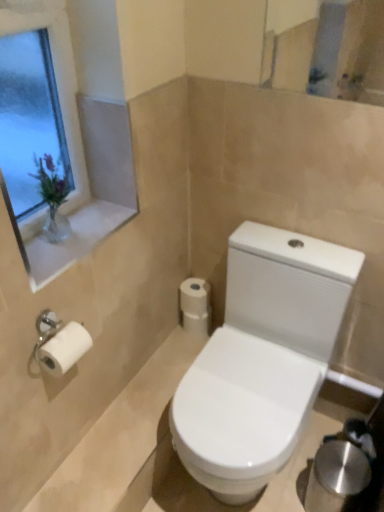
Question: Would you say white glossy toilet at lower center is part of clear glass vase at upper left's contents?

Choices:
 (A) no
 (B) yes

Answer: (A)

Question: Is clear glass vase at upper left smaller than white glossy toilet at lower center?

Choices:
 (A) no
 (B) yes

Answer: (A)

Question: Are clear glass vase at upper left and white glossy toilet at lower center beside each other?

Choices:
 (A) no
 (B) yes

Answer: (A)

Question: Does clear glass vase at upper left lie behind white glossy toilet at lower center?

Choices:
 (A) yes
 (B) no

Answer: (B)

Question: Is clear glass vase at upper left outside white glossy toilet at lower center?

Choices:
 (A) no
 (B) yes

Answer: (B)

Question: Can you confirm if clear glass vase at upper left is taller than white glossy toilet at lower center?

Choices:
 (A) no
 (B) yes

Answer: (B)

Question: Considering the relative sizes of white glossy window sill at upper left and white matte toilet paper at center in the image provided, is white glossy window sill at upper left taller than white matte toilet paper at center?

Choices:
 (A) yes
 (B) no

Answer: (B)

Question: Is there a large distance between white glossy window sill at upper left and white matte toilet paper at center?

Choices:
 (A) no
 (B) yes

Answer: (A)

Question: Considering the relative sizes of white glossy window sill at upper left and white matte toilet paper at center in the image provided, is white glossy window sill at upper left wider than white matte toilet paper at center?

Choices:
 (A) yes
 (B) no

Answer: (A)

Question: Considering the relative positions of white glossy window sill at upper left and white matte toilet paper at center in the image provided, is white glossy window sill at upper left to the right of white matte toilet paper at center from the viewer's perspective?

Choices:
 (A) yes
 (B) no

Answer: (B)

Question: From a real-world perspective, is white glossy window sill at upper left physically above white matte toilet paper at center?

Choices:
 (A) yes
 (B) no

Answer: (A)

Question: From the image's perspective, is white glossy window sill at upper left under white matte toilet paper at center?

Choices:
 (A) no
 (B) yes

Answer: (A)

Question: Is white glossy window sill at upper left looking in the opposite direction of white glossy toilet at lower center?

Choices:
 (A) no
 (B) yes

Answer: (A)